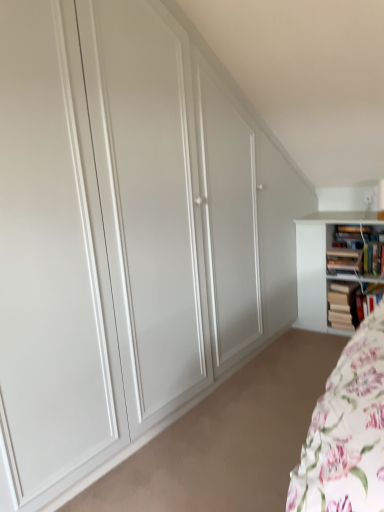
Measure the distance between hardcover book at right, which is counted as the first book, starting from the bottom, and camera.

hardcover book at right, which is counted as the first book, starting from the bottom, is 8.66 feet from camera.

The height and width of the screenshot is (512, 384). I want to click on hardcover books at upper right, which ranks as the first book in top-to-bottom order, so click(x=354, y=252).

In order to face hardcover books at upper right, the fourth book when ordered from bottom to top, should I rotate leftwards or rightwards?

Rotate right and turn 20.683 degrees.

Describe the element at coordinates (344, 305) in the screenshot. I see `wooden book at right, which appears as the 3th book when viewed from the top` at that location.

Locate an element on the screen. This screenshot has height=512, width=384. wooden book at right, marked as the 2th book in a bottom-to-top arrangement is located at coordinates (344, 305).

Where is `wooden bookshelf at right, the 3th book positioned from the bottom`? This screenshot has width=384, height=512. wooden bookshelf at right, the 3th book positioned from the bottom is located at coordinates (344, 260).

Who is bigger, wooden bookshelf at right, the 3th book positioned from the bottom, or hardcover books at upper right, which ranks as the first book in top-to-bottom order?

hardcover books at upper right, which ranks as the first book in top-to-bottom order, is bigger.

Are wooden bookshelf at right, the 3th book positioned from the bottom, and hardcover books at upper right, the fourth book when ordered from bottom to top, far apart?

wooden bookshelf at right, the 3th book positioned from the bottom, is actually quite close to hardcover books at upper right, the fourth book when ordered from bottom to top.

Who is more distant, wooden bookshelf at right, the second book when ordered from top to bottom, or hardcover books at upper right, the fourth book when ordered from bottom to top?

hardcover books at upper right, the fourth book when ordered from bottom to top, is behind.

Would you say wooden bookshelf at right, the 3th book positioned from the bottom, is to the left or to the right of hardcover books at upper right, the fourth book when ordered from bottom to top, in the picture?

wooden bookshelf at right, the 3th book positioned from the bottom, is to the left of hardcover books at upper right, the fourth book when ordered from bottom to top.

Considering the sizes of hardcover book at right, placed as the fourth book when sorted from top to bottom, and wooden book at right, which appears as the 3th book when viewed from the top, in the image, is hardcover book at right, placed as the fourth book when sorted from top to bottom, taller or shorter than wooden book at right, which appears as the 3th book when viewed from the top,?

In the image, hardcover book at right, placed as the fourth book when sorted from top to bottom, appears to be shorter than wooden book at right, which appears as the 3th book when viewed from the top.

From the image's perspective, starting from the hardcover book at right, which is counted as the first book, starting from the bottom, which book is the 1st one above? Please provide its 2D coordinates.

[(344, 305)]

Is the position of hardcover book at right, placed as the fourth book when sorted from top to bottom, less distant than that of wooden book at right, marked as the 2th book in a bottom-to-top arrangement?

Yes, hardcover book at right, placed as the fourth book when sorted from top to bottom, is in front of wooden book at right, marked as the 2th book in a bottom-to-top arrangement.

Is there a large distance between hardcover book at right, which is counted as the first book, starting from the bottom, and wooden book at right, marked as the 2th book in a bottom-to-top arrangement?

No, hardcover book at right, which is counted as the first book, starting from the bottom, is not far away from wooden book at right, marked as the 2th book in a bottom-to-top arrangement.

Based on the photo, which is more to the left, hardcover book at right, which is counted as the first book, starting from the bottom, or wooden bookshelf at right, the second book when ordered from top to bottom?

From the viewer's perspective, wooden bookshelf at right, the second book when ordered from top to bottom, appears more on the left side.

Is hardcover book at right, which is counted as the first book, starting from the bottom, inside the boundaries of wooden bookshelf at right, the second book when ordered from top to bottom, or outside?

hardcover book at right, which is counted as the first book, starting from the bottom, lies outside wooden bookshelf at right, the second book when ordered from top to bottom.

From a real-world perspective, which is physically below, hardcover book at right, placed as the fourth book when sorted from top to bottom, or wooden bookshelf at right, the 3th book positioned from the bottom?

hardcover book at right, placed as the fourth book when sorted from top to bottom, is physically lower.

Is point (361, 308) less distant than point (327, 262)?

Yes, it is in front of point (327, 262).

Considering the points (342, 250) and (357, 293), which point is behind, point (342, 250) or point (357, 293)?

The point (357, 293) is farther from the camera.

From a real-world perspective, is hardcover books at upper right, the fourth book when ordered from bottom to top, above or below hardcover book at right, which is counted as the first book, starting from the bottom?

hardcover books at upper right, the fourth book when ordered from bottom to top, is above hardcover book at right, which is counted as the first book, starting from the bottom.

How different are the orientations of hardcover books at upper right, which ranks as the first book in top-to-bottom order, and hardcover book at right, which is counted as the first book, starting from the bottom, in degrees?

There is a 0.000448-degree angle between the facing directions of hardcover books at upper right, which ranks as the first book in top-to-bottom order, and hardcover book at right, which is counted as the first book, starting from the bottom.

Is hardcover books at upper right, the fourth book when ordered from bottom to top, not close to hardcover book at right, placed as the fourth book when sorted from top to bottom?

Actually, hardcover books at upper right, the fourth book when ordered from bottom to top, and hardcover book at right, placed as the fourth book when sorted from top to bottom, are a little close together.

Starting from the wooden book at right, marked as the 2th book in a bottom-to-top arrangement, which book is the 2nd one in front? Please provide its 2D coordinates.

[(354, 252)]

From a real-world perspective, is hardcover books at upper right, the fourth book when ordered from bottom to top, on top of wooden book at right, marked as the 2th book in a bottom-to-top arrangement?

Yes, from a real-world perspective, hardcover books at upper right, the fourth book when ordered from bottom to top, is over wooden book at right, marked as the 2th book in a bottom-to-top arrangement

In the image, is hardcover books at upper right, the fourth book when ordered from bottom to top, positioned in front of or behind wooden book at right, which appears as the 3th book when viewed from the top?

Visually, hardcover books at upper right, the fourth book when ordered from bottom to top, is located in front of wooden book at right, which appears as the 3th book when viewed from the top.

Which object is wider, hardcover books at upper right, which ranks as the first book in top-to-bottom order, or wooden book at right, which appears as the 3th book when viewed from the top?

wooden book at right, which appears as the 3th book when viewed from the top.

Does wooden bookshelf at right, the 3th book positioned from the bottom, lie in front of hardcover book at right, which is counted as the first book, starting from the bottom?

Yes, the depth of wooden bookshelf at right, the 3th book positioned from the bottom, is less than that of hardcover book at right, which is counted as the first book, starting from the bottom.

Which object is thinner, wooden bookshelf at right, the 3th book positioned from the bottom, or hardcover book at right, which is counted as the first book, starting from the bottom?

wooden bookshelf at right, the 3th book positioned from the bottom, is thinner.

From the image's perspective, is wooden bookshelf at right, the 3th book positioned from the bottom, located above hardcover book at right, placed as the fourth book when sorted from top to bottom?

Yes, from the image's perspective, wooden bookshelf at right, the 3th book positioned from the bottom, is above hardcover book at right, placed as the fourth book when sorted from top to bottom.

From the image's perspective, who appears lower, wooden book at right, which appears as the 3th book when viewed from the top, or wooden bookshelf at right, the 3th book positioned from the bottom?

wooden book at right, which appears as the 3th book when viewed from the top, from the image's perspective.

Considering the relative positions of wooden book at right, which appears as the 3th book when viewed from the top, and wooden bookshelf at right, the 3th book positioned from the bottom, in the image provided, is wooden book at right, which appears as the 3th book when viewed from the top, to the left or to the right of wooden bookshelf at right, the 3th book positioned from the bottom,?

Based on their positions, wooden book at right, which appears as the 3th book when viewed from the top, is located to the right of wooden bookshelf at right, the 3th book positioned from the bottom.

Is wooden bookshelf at right, the second book when ordered from top to bottom, surrounded by wooden book at right, marked as the 2th book in a bottom-to-top arrangement?

No, wooden book at right, marked as the 2th book in a bottom-to-top arrangement, does not contain wooden bookshelf at right, the second book when ordered from top to bottom.

Does wooden book at right, which appears as the 3th book when viewed from the top, lie in front of wooden bookshelf at right, the second book when ordered from top to bottom?

No, it is behind wooden bookshelf at right, the second book when ordered from top to bottom.

This screenshot has width=384, height=512. What are the coordinates of `book in front of the hardcover books at upper right, which ranks as the first book in top-to-bottom order` in the screenshot? It's located at (344, 260).

Find the location of a particular element. The image size is (384, 512). book behind the hardcover book at right, which is counted as the first book, starting from the bottom is located at coordinates (344, 305).

Consider the image. Estimate the real-world distances between objects in this image. Which object is closer to hardcover books at upper right, which ranks as the first book in top-to-bottom order, wooden book at right, which appears as the 3th book when viewed from the top, or wooden bookshelf at right, the second book when ordered from top to bottom?

wooden bookshelf at right, the second book when ordered from top to bottom, lies closer to hardcover books at upper right, which ranks as the first book in top-to-bottom order, than the other object.

Considering their positions, is wooden bookshelf at right, the 3th book positioned from the bottom, positioned further to hardcover books at upper right, the fourth book when ordered from bottom to top, than hardcover book at right, which is counted as the first book, starting from the bottom?

The object further to hardcover books at upper right, the fourth book when ordered from bottom to top, is hardcover book at right, which is counted as the first book, starting from the bottom.

When comparing their distances from wooden bookshelf at right, the second book when ordered from top to bottom, does hardcover book at right, which is counted as the first book, starting from the bottom, or hardcover books at upper right, which ranks as the first book in top-to-bottom order, seem closer?

hardcover books at upper right, which ranks as the first book in top-to-bottom order.

From the image, which object appears to be farther from hardcover books at upper right, which ranks as the first book in top-to-bottom order, wooden bookshelf at right, the 3th book positioned from the bottom, or wooden book at right, marked as the 2th book in a bottom-to-top arrangement?

Based on the image, wooden book at right, marked as the 2th book in a bottom-to-top arrangement, appears to be further to hardcover books at upper right, which ranks as the first book in top-to-bottom order.

Based on their spatial positions, is wooden bookshelf at right, the 3th book positioned from the bottom, or wooden book at right, marked as the 2th book in a bottom-to-top arrangement, further from hardcover book at right, placed as the fourth book when sorted from top to bottom?

Among the two, wooden bookshelf at right, the 3th book positioned from the bottom, is located further to hardcover book at right, placed as the fourth book when sorted from top to bottom.

When comparing their distances from wooden bookshelf at right, the second book when ordered from top to bottom, does wooden book at right, marked as the 2th book in a bottom-to-top arrangement, or hardcover book at right, placed as the fourth book when sorted from top to bottom, seem further?

Based on the image, hardcover book at right, placed as the fourth book when sorted from top to bottom, appears to be further to wooden bookshelf at right, the second book when ordered from top to bottom.

Estimate the real-world distances between objects in this image. Which object is further from hardcover book at right, which is counted as the first book, starting from the bottom, hardcover books at upper right, the fourth book when ordered from bottom to top, or wooden bookshelf at right, the second book when ordered from top to bottom?

hardcover books at upper right, the fourth book when ordered from bottom to top.

Estimate the real-world distances between objects in this image. Which object is further from hardcover book at right, placed as the fourth book when sorted from top to bottom, wooden book at right, marked as the 2th book in a bottom-to-top arrangement, or wooden bookshelf at right, the 3th book positioned from the bottom?

Among the two, wooden bookshelf at right, the 3th book positioned from the bottom, is located further to hardcover book at right, placed as the fourth book when sorted from top to bottom.

Find the location of a particular element. book between wooden bookshelf at right, the second book when ordered from top to bottom, and hardcover book at right, placed as the fourth book when sorted from top to bottom, from top to bottom is located at coordinates (344, 305).

What are the coordinates of `book that lies between hardcover books at upper right, which ranks as the first book in top-to-bottom order, and wooden book at right, which appears as the 3th book when viewed from the top, from top to bottom` in the screenshot? It's located at (344, 260).